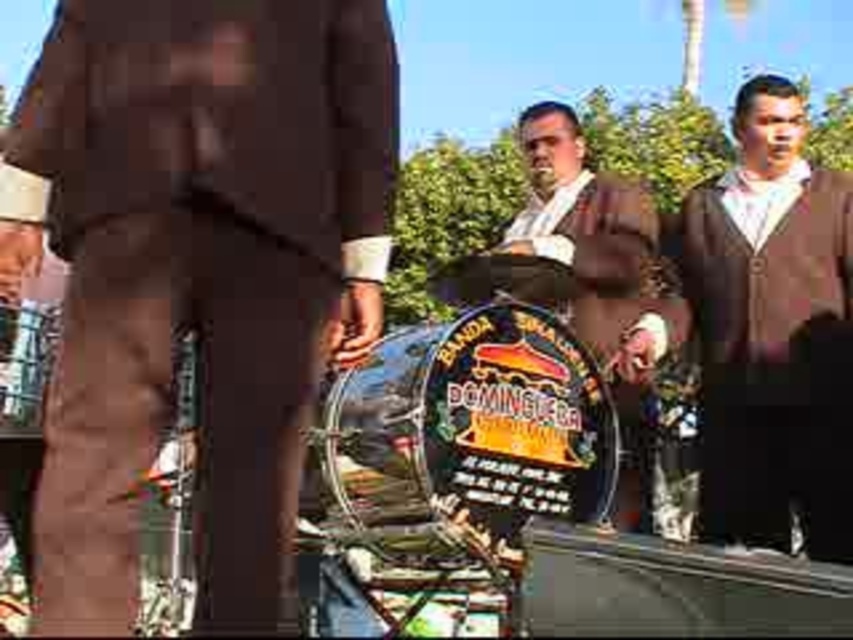
You are organizing a small concert and need to place a 50 cm wide amplifier between the brown wool sweater at right and the shiny brown leather jacket at center. Can the amplifier fit in the space between them?

The distance between the brown wool sweater at right and the shiny brown leather jacket at center is 49.71 centimeters. Since the amplifier is 50 cm wide, it cannot fit in the space between them as the distance is slightly less than the amplifier.

You are a photographer trying to capture a closeup shot of the shiny brown leather jacket at center and the brown fabric pants at center. Which object will appear smaller in the photo?

The brown fabric pants at center will appear smaller in the photo because it occupies less space than the shiny brown leather jacket at center.

You are organizing a costume party and need to decide which outfit to wear. You have the brown wool sweater at right and the shiny brown leather jacket at center. If you want to wear the larger one, which should you choose?

The shiny brown leather jacket at center is larger than the brown wool sweater at right, so you should choose the shiny brown leather jacket at center.